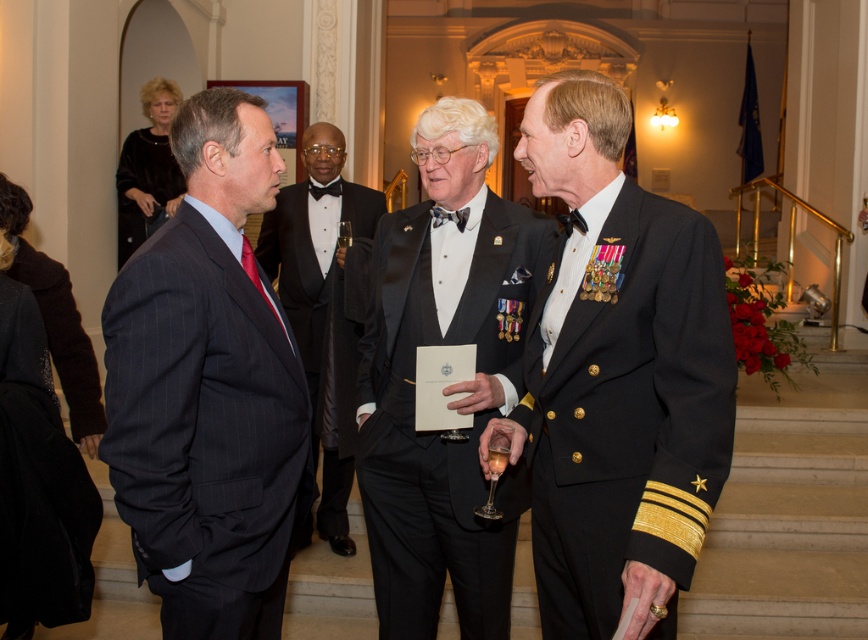
Who is shorter, shiny black uniform at center or matte black suit at center?

shiny black uniform at center

Is point (586, 576) positioned in front of point (319, 196)?

That is True.

Locate an element on the screen. The height and width of the screenshot is (640, 868). shiny black uniform at center is located at coordinates point(617,376).

Consider the image. Who is higher up, shiny black uniform at center or dark pinstripe suit at left?

Positioned higher is shiny black uniform at center.

Does shiny black uniform at center appear on the left side of dark pinstripe suit at left?

No, shiny black uniform at center is not to the left of dark pinstripe suit at left.

Describe the element at coordinates (617, 376) in the screenshot. This screenshot has width=868, height=640. I see `shiny black uniform at center` at that location.

Where is `shiny black uniform at center`? The height and width of the screenshot is (640, 868). shiny black uniform at center is located at coordinates (x=617, y=376).

Is dark pinstripe suit at left further to the viewer compared to shiny black suit at center?

No, it is in front of shiny black suit at center.

Is dark pinstripe suit at left to the right of shiny black suit at center from the viewer's perspective?

Incorrect, dark pinstripe suit at left is not on the right side of shiny black suit at center.

Find the location of a particular element. dark pinstripe suit at left is located at coordinates (208, 388).